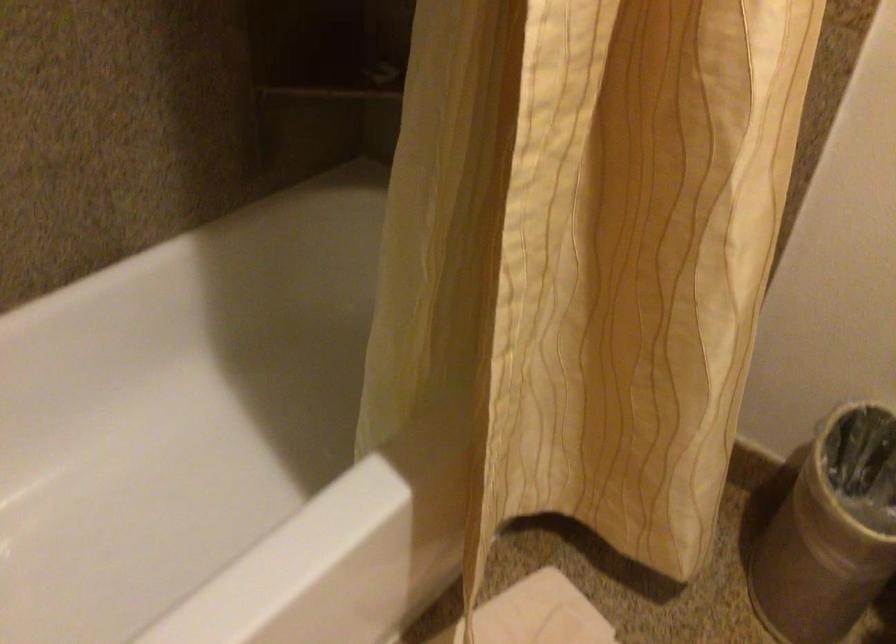
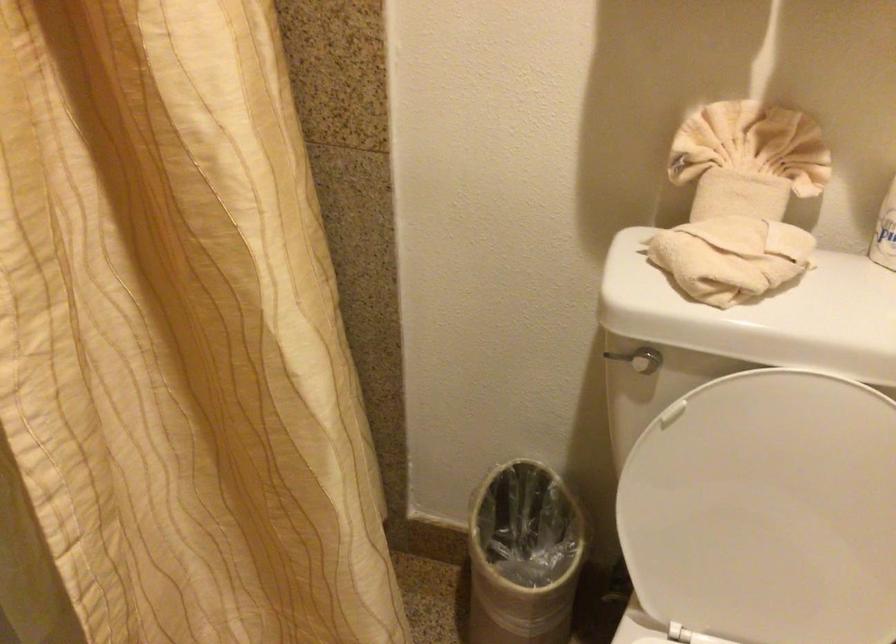
Question: The camera is either moving clockwise (left) or counter-clockwise (right) around the object. The first image is from the beginning of the video and the second image is from the end. Is the camera moving left or right when shooting the video?

Choices:
 (A) Left
 (B) Right

Answer: (A)